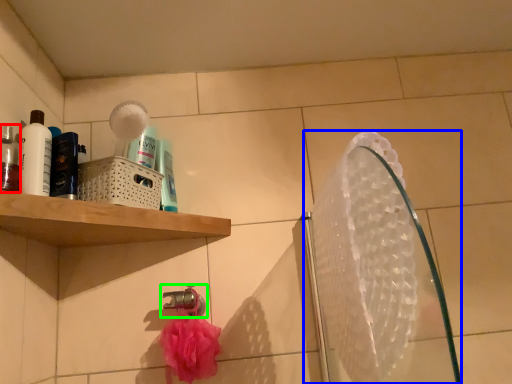
Question: Which is nearer to the mouthwash (highlighted by a red box)? mirror (highlighted by a blue box) or tap (highlighted by a green box).

Choices:
 (A) mirror
 (B) tap

Answer: (B)